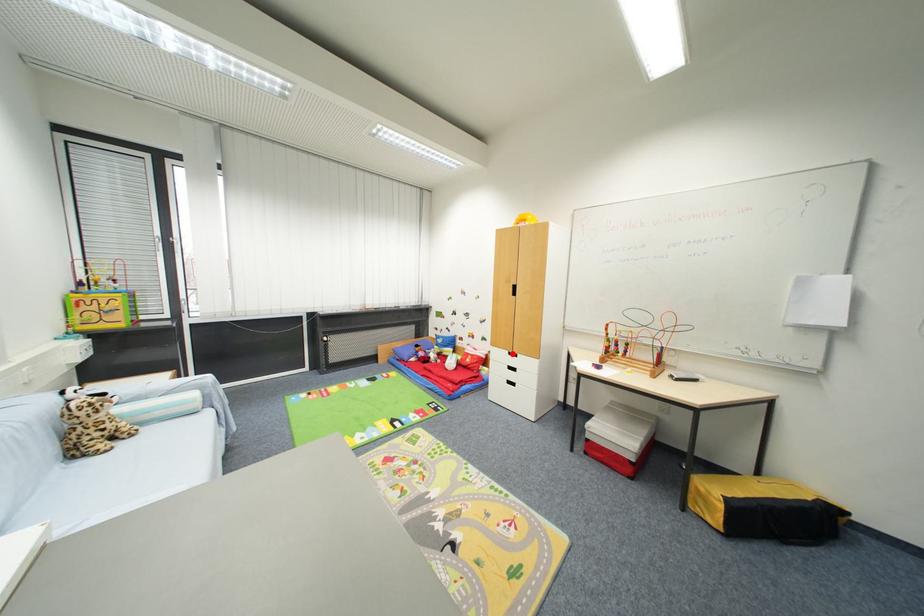
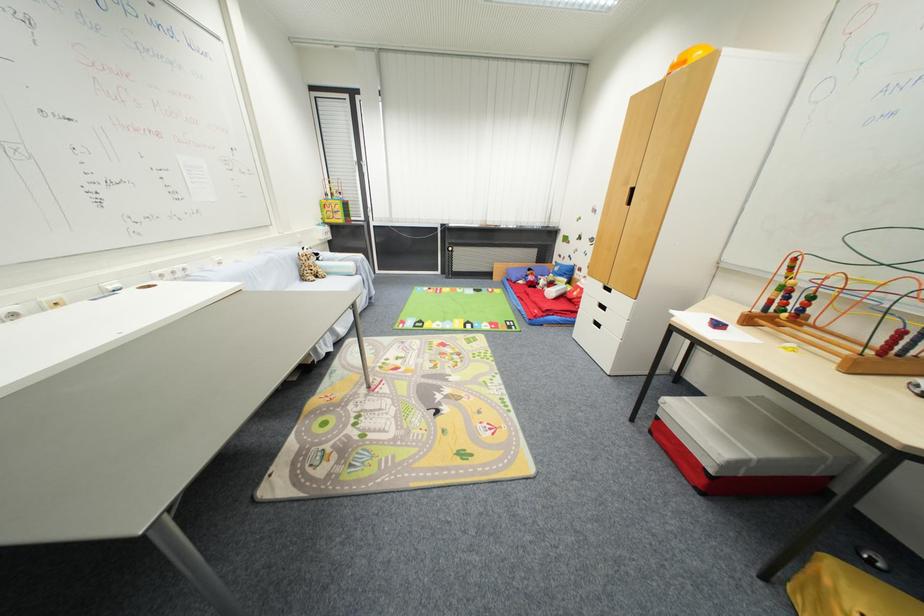
Question: A red point is marked in image1. In image2, is the corresponding 3D point closer to the camera or farther? Reply with the corresponding letter.

Choices:
 (A) The corresponding 3D point is closer.
 (B) The corresponding 3D point is farther.

Answer: (A)